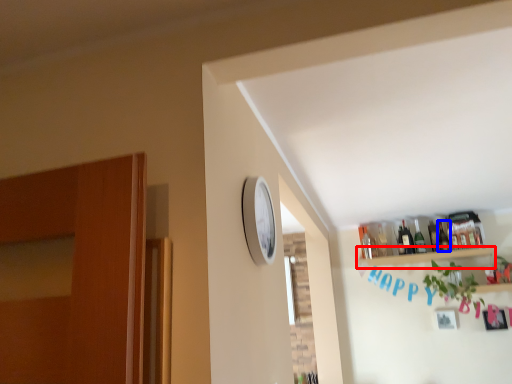
Question: Which object is closer to the camera taking this photo, shelf (highlighted by a red box) or bottle (highlighted by a blue box)?

Choices:
 (A) shelf
 (B) bottle

Answer: (A)